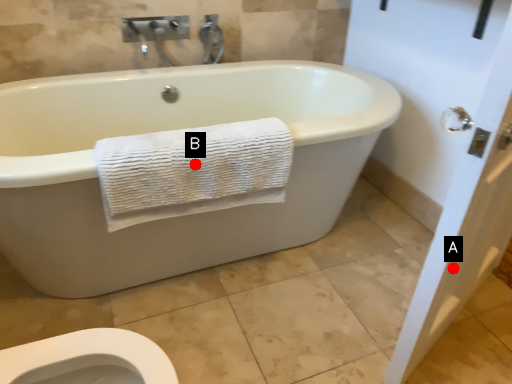
Question: Two points are circled on the image, labeled by A and B beside each circle. Which point is closer to the camera?

Choices:
 (A) A is closer
 (B) B is closer

Answer: (A)